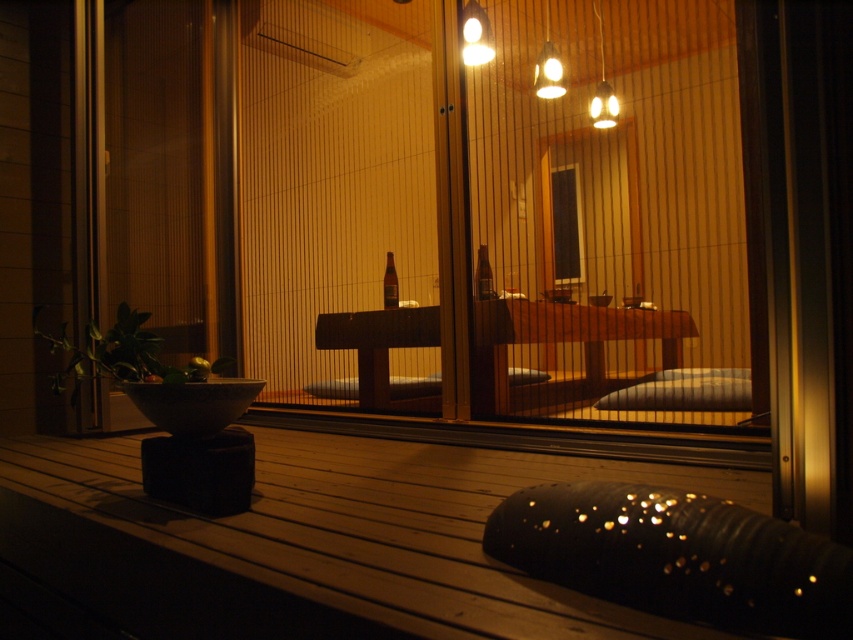
You are trying to place a new decorative item on the table in the scene. The table has limited space, and you need to ensure it doesn not block the view of the matte glass bottle at center. Where should you place the new item to avoid covering the bottle?

The matte glass bottle at center is located at point [483,275], so placing the new item away from this coordinate will ensure it does not block the view of the bottle.